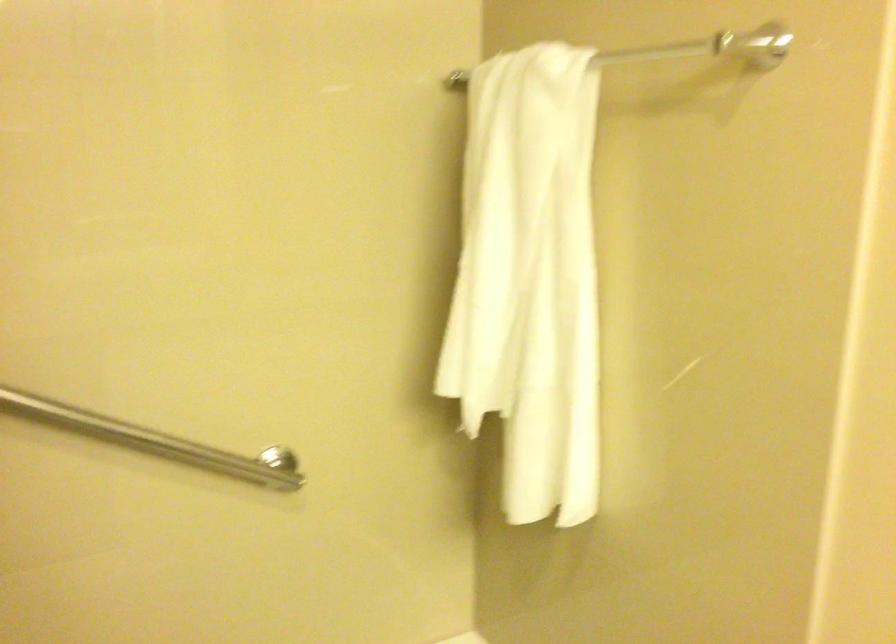
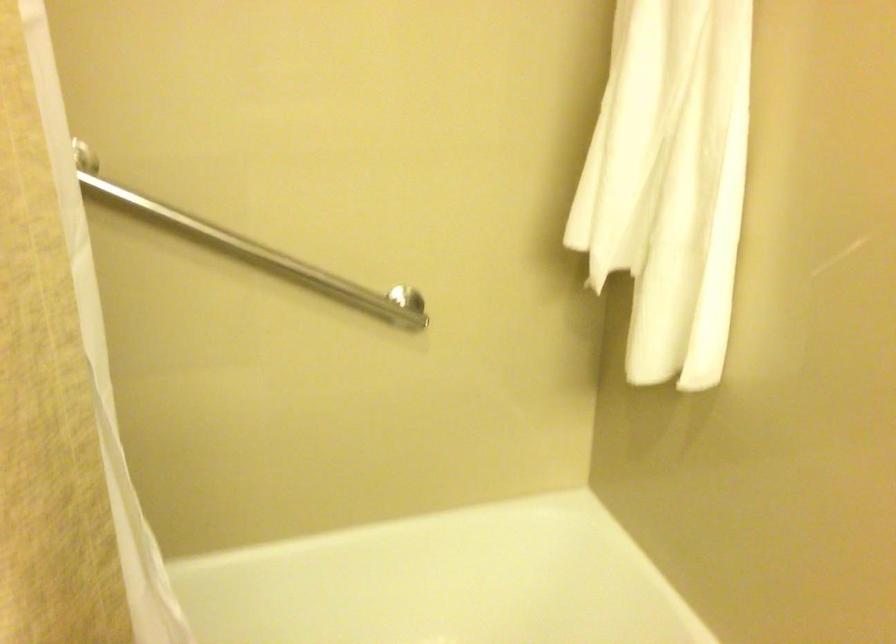
In the second image, find the point that corresponds to point (119, 420) in the first image.

(256, 251)